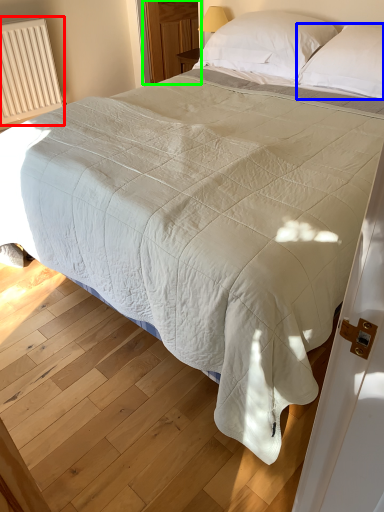
Question: Based on their relative distances, which object is nearer to radiator (highlighted by a red box)? Choose from pillow (highlighted by a blue box) and glass door (highlighted by a green box).

Choices:
 (A) pillow
 (B) glass door

Answer: (B)